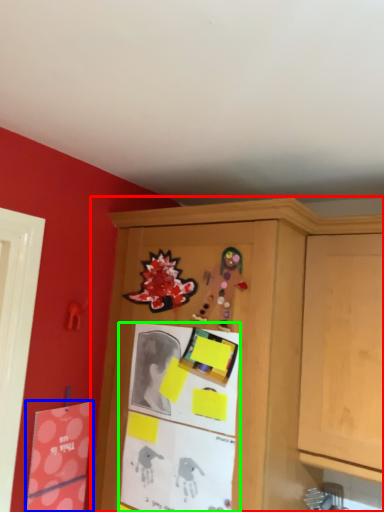
Question: Which is farther away from cabinetry (highlighted by a red box)? postcard (highlighted by a blue box) or bulletin board (highlighted by a green box)?

Choices:
 (A) postcard
 (B) bulletin board

Answer: (A)